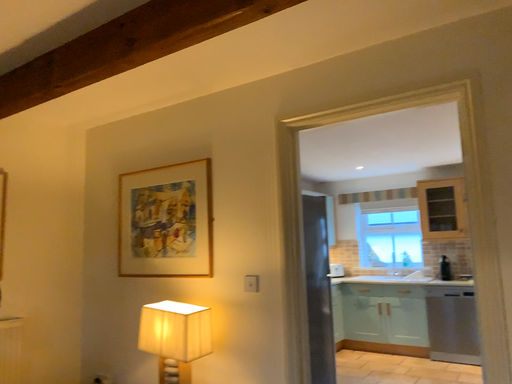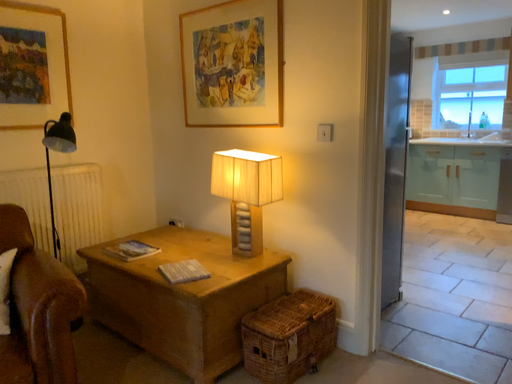
Question: How did the camera likely rotate when shooting the video?

Choices:
 (A) rotated downward
 (B) rotated upward

Answer: (A)